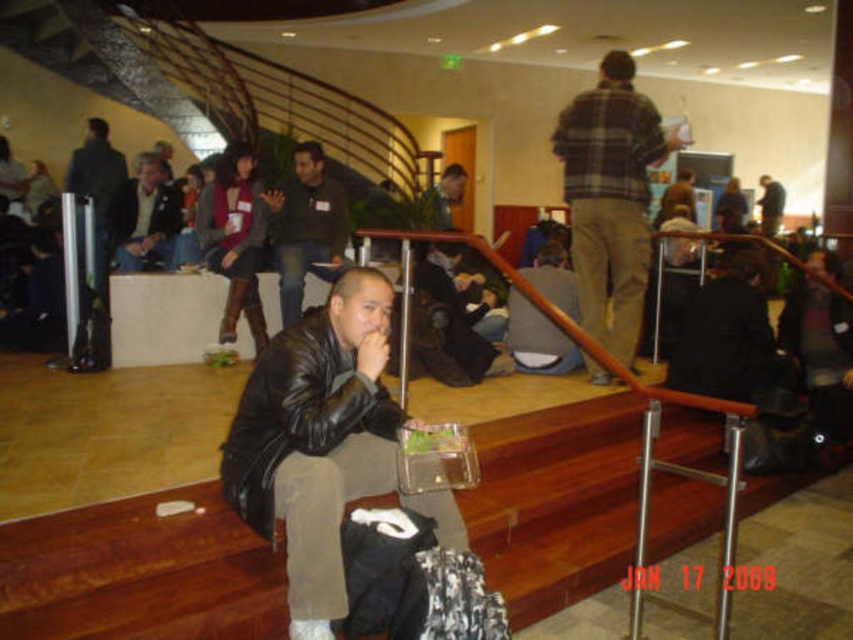
Question: Among these points, which one is nearest to the camera?

Choices:
 (A) (236, 442)
 (B) (637, 246)
 (C) (70, 163)

Answer: (A)

Question: Does dark gray leather jacket at center have a greater width compared to light brown leather jacket at upper left?

Choices:
 (A) yes
 (B) no

Answer: (B)

Question: Among these points, which one is farthest from the camera?

Choices:
 (A) [x=514, y=340]
 (B) [x=312, y=266]
 (C) [x=297, y=346]

Answer: (B)

Question: Which point is closer to the camera taking this photo?

Choices:
 (A) (764, 182)
 (B) (613, 209)
 (C) (167, 257)

Answer: (B)

Question: Is dark gray sweater at center below dark gray leather jacket at center?

Choices:
 (A) no
 (B) yes

Answer: (A)

Question: Can you confirm if leather jacket at center is positioned to the left of dark gray leather jacket at center?

Choices:
 (A) yes
 (B) no

Answer: (A)